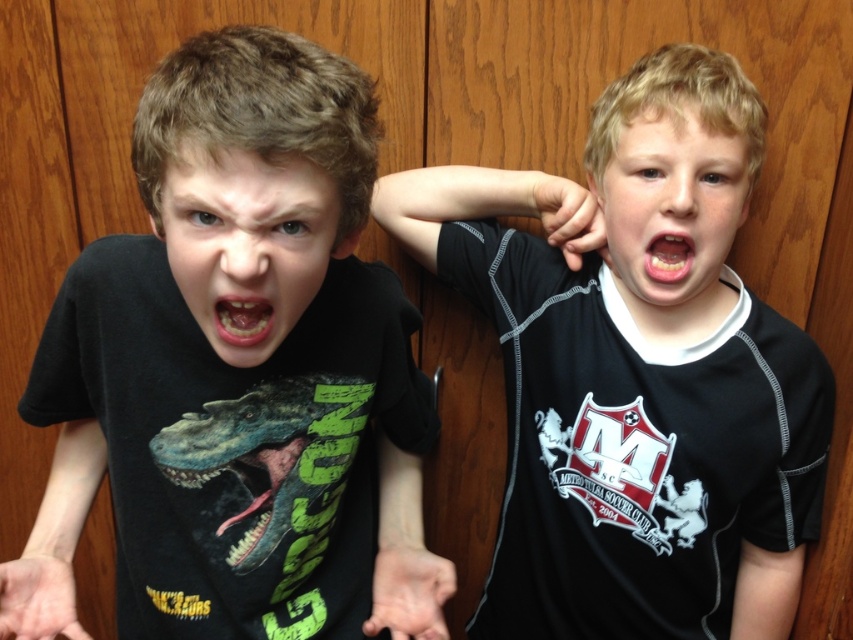
Which is above, black matte t-shirt at center or teeth at center?

Positioned higher is teeth at center.

Can you confirm if black matte t-shirt at center is positioned below teeth at center?

Yes, black matte t-shirt at center is below teeth at center.

Find the location of a particular element. This screenshot has width=853, height=640. black matte t-shirt at center is located at coordinates (234, 368).

Image resolution: width=853 pixels, height=640 pixels. I want to click on black matte t-shirt at center, so click(x=234, y=368).

Which is behind, point (230, 337) or point (666, 269)?

The point (666, 269) is behind.

Does point (260, 300) come behind point (677, 275)?

No, (260, 300) is in front of (677, 275).

Find the location of a particular element. The image size is (853, 640). teeth at center is located at coordinates (242, 320).

The width and height of the screenshot is (853, 640). I want to click on smooth skin face at center, so click(x=247, y=243).

Locate an element on the screen. The width and height of the screenshot is (853, 640). smooth skin face at center is located at coordinates (247, 243).